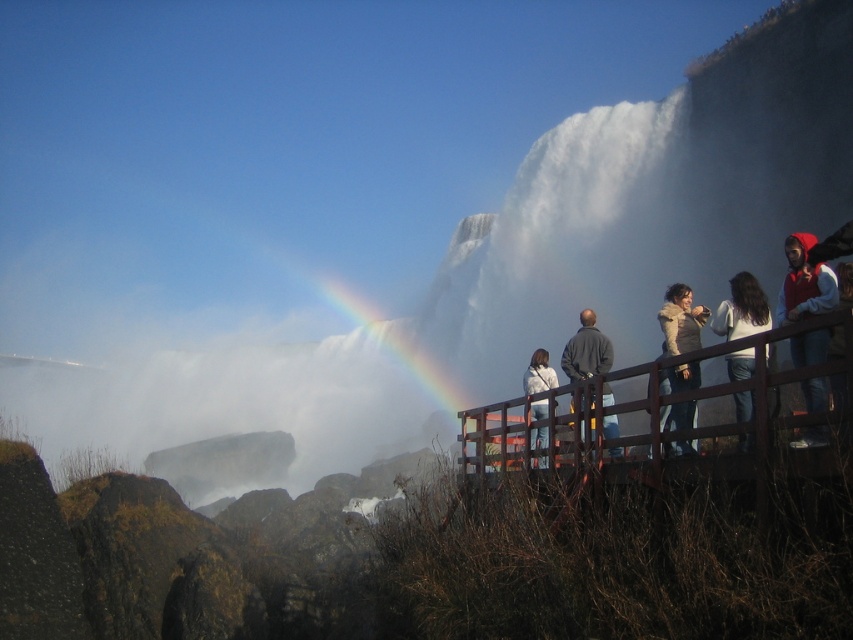
Is red knit hat at upper right shorter than dark gray jacket at center?

No.

What do you see at coordinates (804, 282) in the screenshot?
I see `red knit hat at upper right` at bounding box center [804, 282].

Which is in front, point (804, 241) or point (614, 419)?

Point (614, 419) is more forward.

Identify the location of red knit hat at upper right. The height and width of the screenshot is (640, 853). (804, 282).

Find the location of a particular element. The height and width of the screenshot is (640, 853). brown wooden rail at right is located at coordinates (640, 408).

Can you confirm if brown wooden rail at right is positioned above light brown fur coat at center?

No, brown wooden rail at right is not above light brown fur coat at center.

Identify the location of brown wooden rail at right. This screenshot has height=640, width=853. (640, 408).

Between brown wooden rail at right and dark gray jacket at center, which one is positioned lower?

brown wooden rail at right is below.

Image resolution: width=853 pixels, height=640 pixels. What do you see at coordinates (640, 408) in the screenshot?
I see `brown wooden rail at right` at bounding box center [640, 408].

Identify the location of brown wooden rail at right. (640, 408).